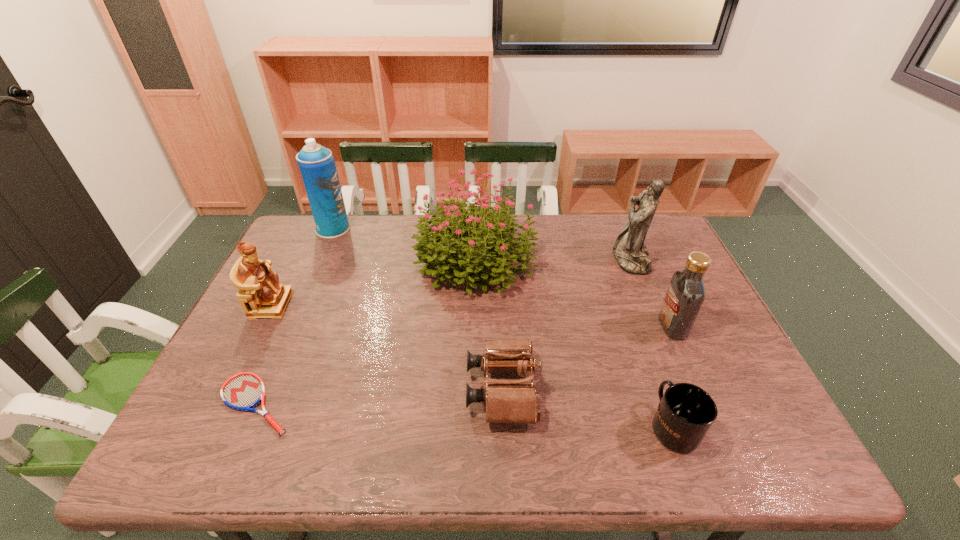
This screenshot has width=960, height=540. Identify the location of mug that is at the near edge. (686, 412).

This screenshot has width=960, height=540. Identify the location of tennis racket present at the near edge. (244, 391).

At what (x,y) coordinates should I click in order to perform the action: click on aerosol can that is at the left edge. Please return your answer as a coordinate pair (x, y). Looking at the image, I should click on (317, 165).

Find the location of `figurine located in the left edge section of the desktop`. figurine located in the left edge section of the desktop is located at coordinates (260, 294).

You are a GUI agent. You are given a task and a screenshot of the screen. Output one action in this format:
    pyautogui.click(x=<x>, y=<y>)
    Task: Click on the tennis racket present at the left edge
    The height and width of the screenshot is (540, 960).
    Given the screenshot: What is the action you would take?
    pyautogui.click(x=244, y=391)

What are the coordinates of `figurine positioned at the right edge` in the screenshot? It's located at (629, 250).

This screenshot has height=540, width=960. I want to click on vodka at the right edge, so click(x=686, y=293).

At what (x,y) coordinates should I click in order to perform the action: click on object at the far left corner. Please return your answer as a coordinate pair (x, y). The height and width of the screenshot is (540, 960). Looking at the image, I should click on (317, 165).

You are a GUI agent. You are given a task and a screenshot of the screen. Output one action in this format:
    pyautogui.click(x=<x>, y=<y>)
    Task: Click on the object located in the near left corner section of the desktop
    
    Given the screenshot: What is the action you would take?
    click(x=244, y=391)

You are a GUI agent. You are given a task and a screenshot of the screen. Output one action in this format:
    pyautogui.click(x=<x>, y=<y>)
    Task: Click on the object situated at the far right corner
    Image resolution: width=960 pixels, height=540 pixels.
    Given the screenshot: What is the action you would take?
    pyautogui.click(x=629, y=250)